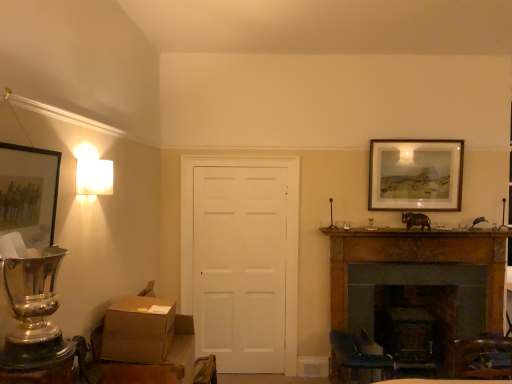
Question: Considering the relative sizes of wooden fireplace at lower right and matte black picture frame at left, placed as the 2th picture frame when sorted from right to left, in the image provided, is wooden fireplace at lower right wider than matte black picture frame at left, placed as the 2th picture frame when sorted from right to left,?

Choices:
 (A) no
 (B) yes

Answer: (A)

Question: Is wooden fireplace at lower right at the right side of matte black picture frame at left, placed as the 2th picture frame when sorted from right to left?

Choices:
 (A) yes
 (B) no

Answer: (A)

Question: Is wooden fireplace at lower right not within matte black picture frame at left, acting as the first picture frame starting from the front?

Choices:
 (A) no
 (B) yes

Answer: (B)

Question: Can you confirm if wooden fireplace at lower right is taller than matte black picture frame at left, arranged as the second picture frame when viewed from the back?

Choices:
 (A) no
 (B) yes

Answer: (B)

Question: Can you confirm if wooden fireplace at lower right is positioned to the left of matte black picture frame at left, which ranks as the first picture frame in left-to-right order?

Choices:
 (A) no
 (B) yes

Answer: (A)

Question: From a real-world perspective, is white matte door at center positioned above or below wooden fireplace at lower right?

Choices:
 (A) above
 (B) below

Answer: (A)

Question: Is white matte door at center inside the boundaries of wooden fireplace at lower right, or outside?

Choices:
 (A) outside
 (B) inside

Answer: (A)

Question: Visually, is white matte door at center positioned to the left or to the right of wooden fireplace at lower right?

Choices:
 (A) left
 (B) right

Answer: (A)

Question: In terms of width, does white matte door at center look wider or thinner when compared to wooden fireplace at lower right?

Choices:
 (A) thin
 (B) wide

Answer: (B)

Question: Is white matte square lamp at upper left taller or shorter than white matte door at center?

Choices:
 (A) short
 (B) tall

Answer: (A)

Question: From the image's perspective, is white matte square lamp at upper left positioned above or below white matte door at center?

Choices:
 (A) above
 (B) below

Answer: (A)

Question: Is white matte square lamp at upper left spatially inside white matte door at center, or outside of it?

Choices:
 (A) inside
 (B) outside

Answer: (B)

Question: Is white matte square lamp at upper left wider or thinner than white matte door at center?

Choices:
 (A) thin
 (B) wide

Answer: (B)

Question: Is brown cardboard box at lower left in front of or behind white matte door at center in the image?

Choices:
 (A) front
 (B) behind

Answer: (A)

Question: Do you think brown cardboard box at lower left is within white matte door at center, or outside of it?

Choices:
 (A) outside
 (B) inside

Answer: (A)